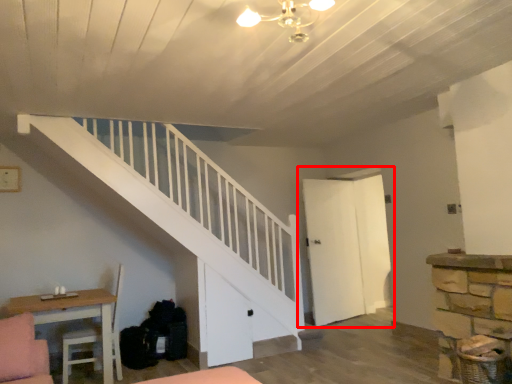
Question: From the image's perspective, what is the correct spatial relationship of door (annotated by the red box) in relation to table?

Choices:
 (A) below
 (B) above

Answer: (B)